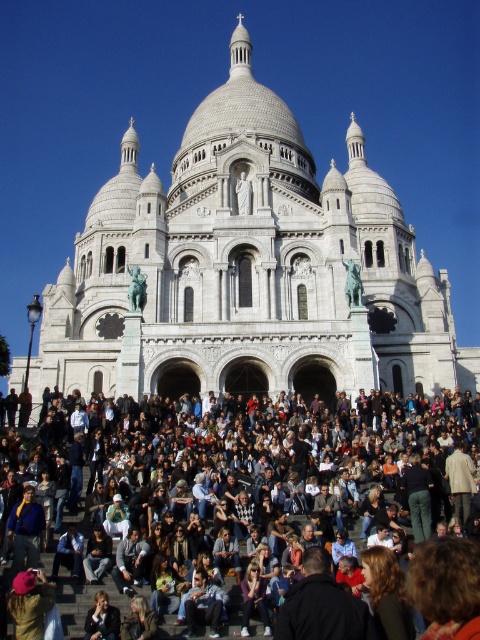
Question: Is white stone church at center below light brown leather jacket at lower center?

Choices:
 (A) yes
 (B) no

Answer: (B)

Question: Estimate the real-world distances between objects in this image. Which object is closer to the white stone church at center?

Choices:
 (A) multicolored fabric crowd at center
 (B) brown leather jacket at lower center

Answer: (A)

Question: Does white stone church at center appear on the left side of brown leather jacket at lower center?

Choices:
 (A) no
 (B) yes

Answer: (B)

Question: Where is white stone church at center located in relation to multicolored fabric crowd at center in the image?

Choices:
 (A) left
 (B) right

Answer: (A)

Question: Which point is closer to the camera taking this photo?

Choices:
 (A) (87, 636)
 (B) (151, 620)

Answer: (A)

Question: Which object appears closest to the camera in this image?

Choices:
 (A) multicolored fabric crowd at center
 (B) light brown leather jacket at lower center
 (C) brown leather jacket at lower center

Answer: (A)